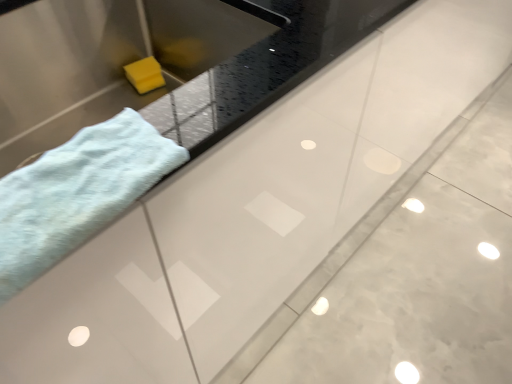
Measure the distance between matte stainless steel sink at left and camera.

25.87 inches.

Identify the location of matte stainless steel sink at left. Image resolution: width=512 pixels, height=384 pixels. (106, 60).

This screenshot has height=384, width=512. What do you see at coordinates (106, 60) in the screenshot? I see `matte stainless steel sink at left` at bounding box center [106, 60].

Measure the distance between point (0, 133) and camera.

Point (0, 133) and camera are 78.80 centimeters apart.

This screenshot has height=384, width=512. Find the location of `soft blue towel at left`. soft blue towel at left is located at coordinates (77, 193).

Describe the element at coordinates (77, 193) in the screenshot. This screenshot has height=384, width=512. I see `soft blue towel at left` at that location.

Identify the location of matte stainless steel sink at left. This screenshot has width=512, height=384. (106, 60).

Visually, is soft blue towel at left positioned to the left or to the right of matte stainless steel sink at left?

From the image, it's evident that soft blue towel at left is to the right of matte stainless steel sink at left.

Does soft blue towel at left lie in front of matte stainless steel sink at left?

Yes, soft blue towel at left is in front of matte stainless steel sink at left.

Does point (161, 169) come farther from viewer compared to point (92, 19)?

No, (161, 169) is in front of (92, 19).

From the image's perspective, which is below, soft blue towel at left or matte stainless steel sink at left?

soft blue towel at left is shown below in the image.

From a real-world perspective, is soft blue towel at left on top of matte stainless steel sink at left?

Yes.

Can you confirm if soft blue towel at left is wider than matte stainless steel sink at left?

Incorrect, the width of soft blue towel at left does not surpass that of matte stainless steel sink at left.

Can you confirm if soft blue towel at left is shorter than matte stainless steel sink at left?

Yes.

Considering the relative sizes of soft blue towel at left and matte stainless steel sink at left in the image provided, is soft blue towel at left bigger than matte stainless steel sink at left?

No.

Looking at this image, does soft blue towel at left contain matte stainless steel sink at left?

No, matte stainless steel sink at left is not a part of soft blue towel at left.

Is soft blue towel at left not near matte stainless steel sink at left?

No, soft blue towel at left is not far from matte stainless steel sink at left.

Is soft blue towel at left turned away from matte stainless steel sink at left?

No, soft blue towel at left's orientation is not away from matte stainless steel sink at left.

What's the angular difference between soft blue towel at left and matte stainless steel sink at left's facing directions?

0.000349 degrees separate the facing orientations of soft blue towel at left and matte stainless steel sink at left.

Locate an element on the screen. The width and height of the screenshot is (512, 384). sink that is under the soft blue towel at left (from a real-world perspective) is located at coordinates (106, 60).

Visually, is matte stainless steel sink at left positioned to the left or to the right of soft blue towel at left?

Based on their positions, matte stainless steel sink at left is located to the left of soft blue towel at left.

Is matte stainless steel sink at left behind soft blue towel at left?

Yes, the depth of matte stainless steel sink at left is greater than that of soft blue towel at left.

Which is behind, point (157, 94) or point (51, 209)?

Positioned behind is point (157, 94).

From the picture: From the image's perspective, which one is positioned higher, matte stainless steel sink at left or soft blue towel at left?

matte stainless steel sink at left, from the image's perspective.

From a real-world perspective, between matte stainless steel sink at left and soft blue towel at left, who is vertically higher?

soft blue towel at left is physically above.

Is matte stainless steel sink at left thinner than soft blue towel at left?

No, matte stainless steel sink at left is not thinner than soft blue towel at left.

Is matte stainless steel sink at left taller than soft blue towel at left?

Yes, matte stainless steel sink at left is taller than soft blue towel at left.

From the picture: Looking at the image, does matte stainless steel sink at left seem bigger or smaller compared to soft blue towel at left?

In the image, matte stainless steel sink at left appears to be larger than soft blue towel at left.

Would you say soft blue towel at left is part of matte stainless steel sink at left's contents?

No, soft blue towel at left is not inside matte stainless steel sink at left.

Are matte stainless steel sink at left and soft blue towel at left making contact?

No, matte stainless steel sink at left is not beside soft blue towel at left.

Looking at this image, does matte stainless steel sink at left turn towards soft blue towel at left?

Yes.

How many degrees apart are the facing directions of matte stainless steel sink at left and soft blue towel at left?

matte stainless steel sink at left and soft blue towel at left are facing 0.000349 degrees away from each other.

Measure the distance between matte stainless steel sink at left and soft blue towel at left.

matte stainless steel sink at left and soft blue towel at left are 16.43 inches apart.

The width and height of the screenshot is (512, 384). What are the coordinates of `towel in front of the matte stainless steel sink at left` in the screenshot? It's located at (77, 193).

This screenshot has width=512, height=384. In the image, there is a soft blue towel at left. What are the coordinates of `sink below it (from a real-world perspective)` in the screenshot? It's located at (106, 60).

Where is `towel that appears on the right of matte stainless steel sink at left`? The height and width of the screenshot is (384, 512). towel that appears on the right of matte stainless steel sink at left is located at coordinates (77, 193).